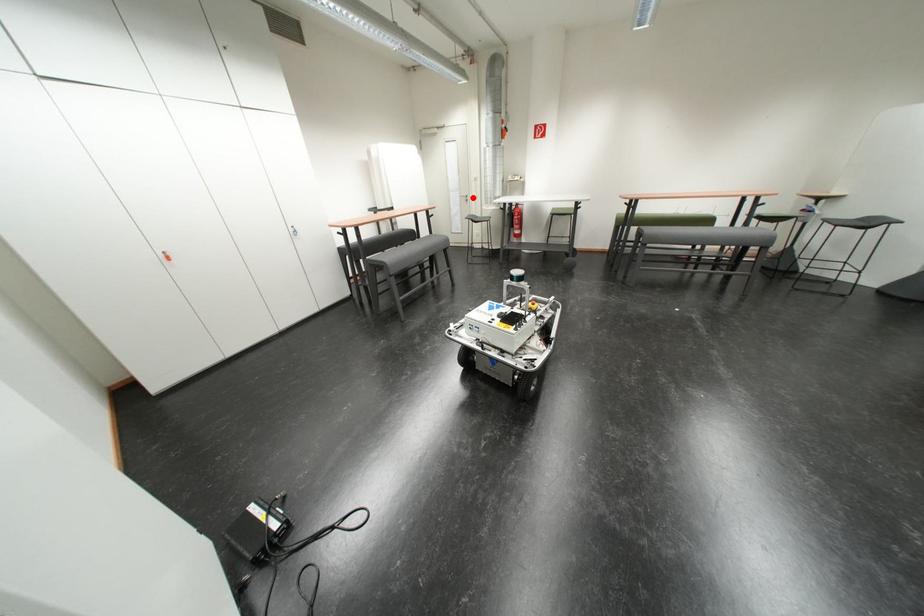
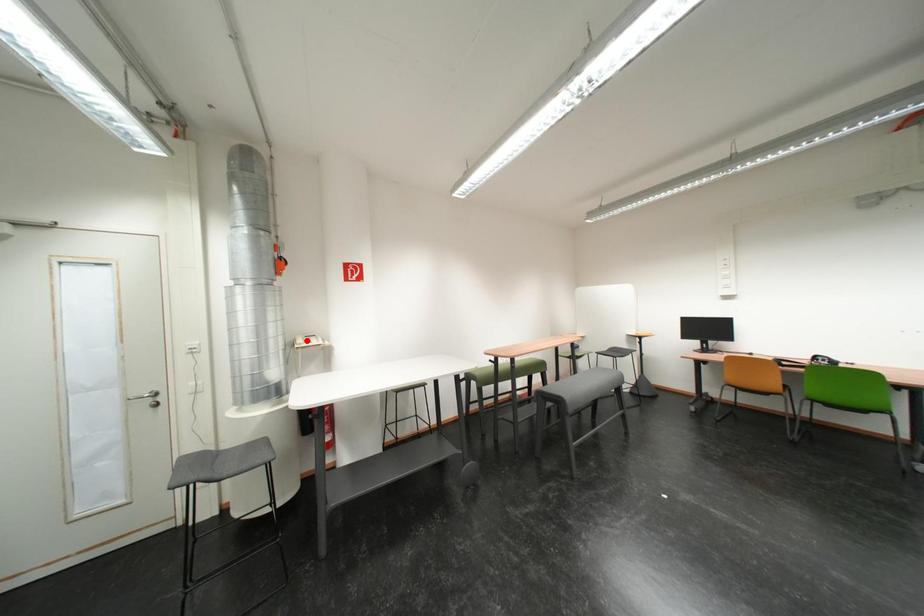
I am providing you with two images of the same scene from different viewpoints. A red point is marked on the first image and another point is marked on the second image. Do the highlighted points in image1 and image2 indicate the same real-world spot?

No